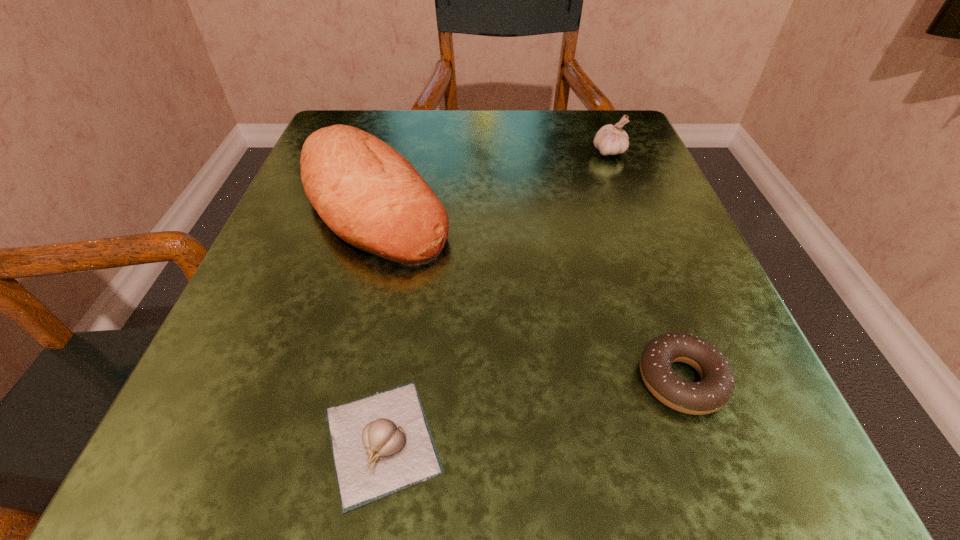
I want to click on free space at the far edge of the desktop, so click(537, 114).

Identify the location of vacant region at the near edge of the desktop. The height and width of the screenshot is (540, 960). (326, 455).

You are a GUI agent. You are given a task and a screenshot of the screen. Output one action in this format:
    pyautogui.click(x=<x>, y=<y>)
    Task: Click on the vacant region at the left edge
    This screenshot has height=540, width=960.
    Given the screenshot: What is the action you would take?
    pyautogui.click(x=299, y=178)

What are the coordinates of `free region at the right edge of the desktop` in the screenshot? It's located at (682, 258).

Locate an element on the screen. Image resolution: width=960 pixels, height=540 pixels. vacant space at the far left corner of the desktop is located at coordinates (354, 123).

The height and width of the screenshot is (540, 960). Identify the location of vacant area at the near left corner. (260, 436).

The width and height of the screenshot is (960, 540). Identify the location of vacant space at the far right corner of the desktop. (620, 157).

The height and width of the screenshot is (540, 960). I want to click on vacant area at the near right corner, so click(x=750, y=506).

What are the coordinates of `free space between the third tallest object and the bread` in the screenshot? It's located at (527, 292).

Identify the location of vacant space in between the shortest object and the taller garlic. The height and width of the screenshot is (540, 960). click(x=495, y=296).